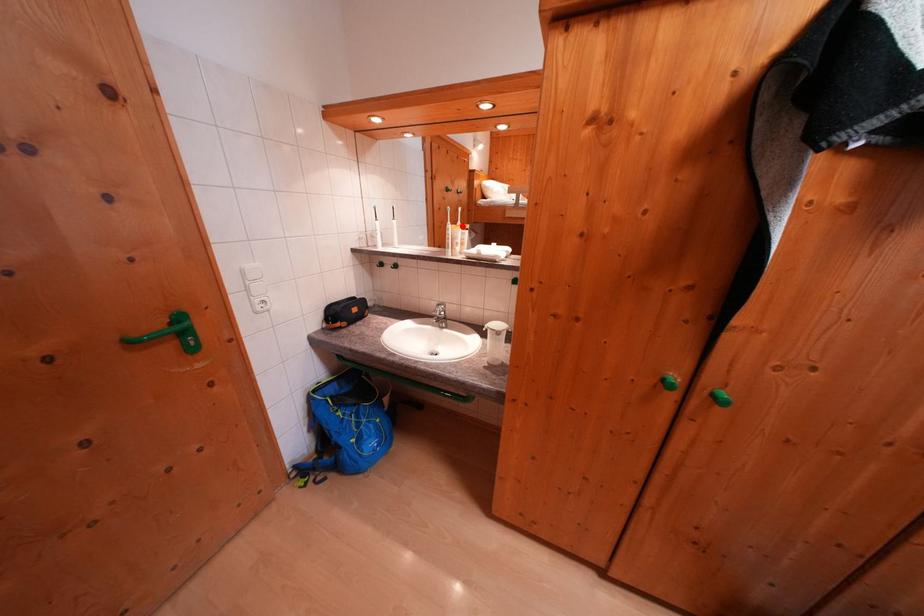
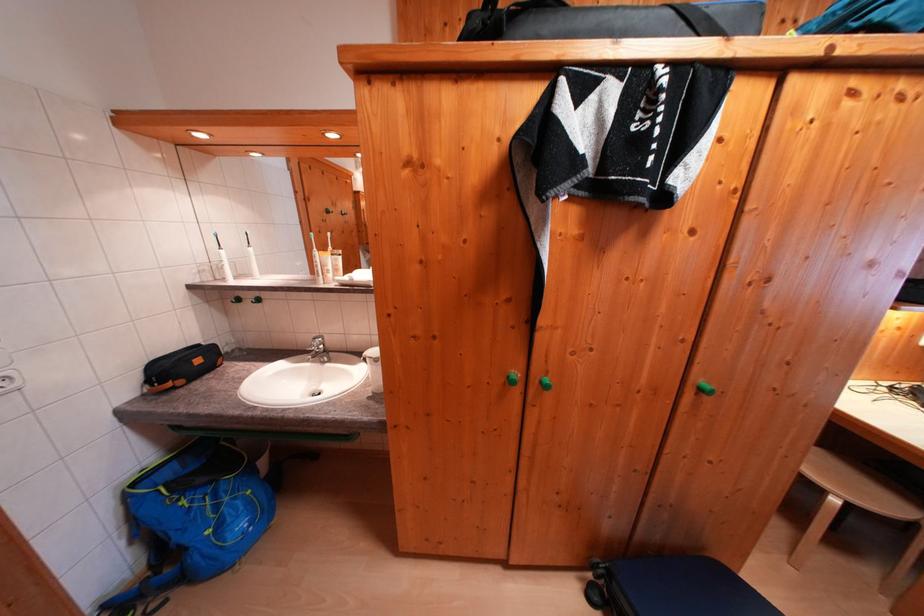
Find the pixel in the second image that matches the highlighted location in the first image.

(331, 253)